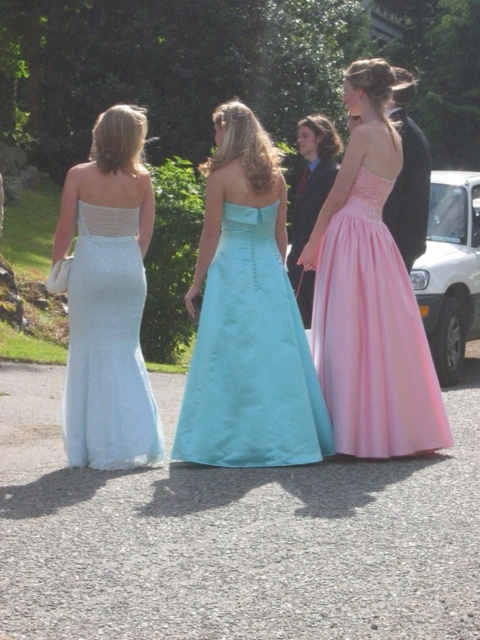
You are a photographer at a prom event. You need to capture a group photo of the attendees. The pink satin dress at center and the satin white dress at center are currently positioned close to each other. If you want to ensure there is at least 5 feet of space between them for better composition, would their current distance suffice?

The pink satin dress at center is 4.21 feet from the satin white dress at center. Since 4.21 feet is less than the required 5 feet, the current distance is insufficient. They need to move further apart to achieve the desired spacing.

You are a photographer who wants to capture a closeup shot of the pink satin dress at center without including the satin white dress at center in the frame. Based on their positions, is this possible?

The pink satin dress at center is further to the viewer than the satin white dress at center, so yes, the photographer can focus on the pink satin dress at center without including the satin white dress at center in the frame since it is closer to the camera.